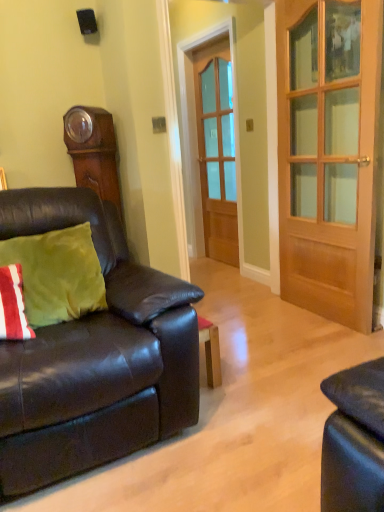
Locate an element on the screen. This screenshot has width=384, height=512. free area in between matte black couch at left and wooden door at center, which is counted as the 2th door, starting from the left is located at coordinates (273, 347).